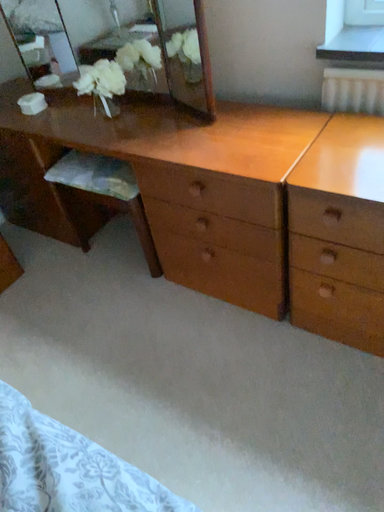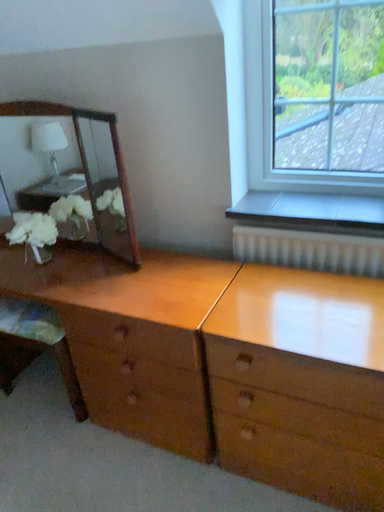
Question: How did the camera likely rotate when shooting the video?

Choices:
 (A) rotated downward
 (B) rotated upward

Answer: (B)